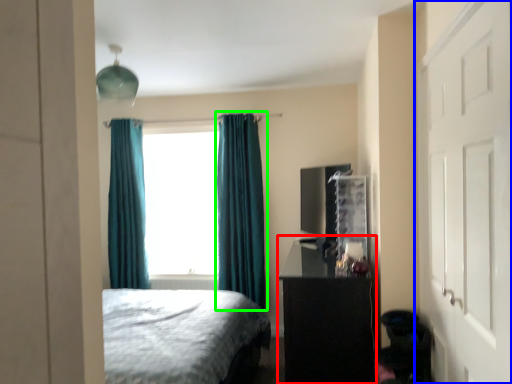
Question: Which object is positioned farthest from vanity (highlighted by a red box)? Select from door (highlighted by a blue box) and curtain (highlighted by a green box).

Choices:
 (A) door
 (B) curtain

Answer: (B)